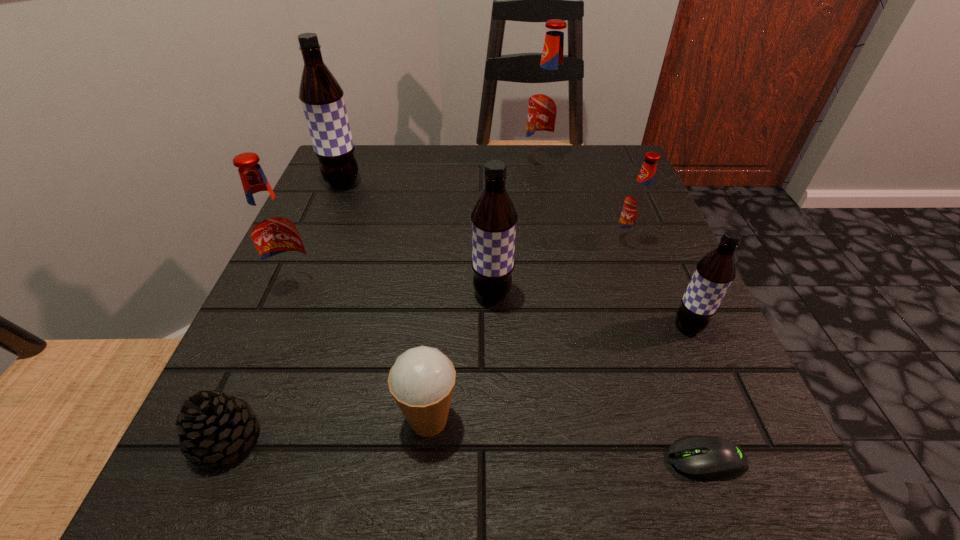
I want to click on vacant region between the second farthest root beer and the leftmost red root beer, so click(x=319, y=234).

Identify which object is located as the seventh nearest to the gray computer mouse. Please provide its 2D coordinates. Your answer should be formatted as a tuple, i.e. [(x, y)], where the tuple contains the x and y coordinates of a point satisfying the conditions above.

[(548, 98)]

Where is `the second closest object relative to the leftmost brown root beer`? Image resolution: width=960 pixels, height=540 pixels. the second closest object relative to the leftmost brown root beer is located at coordinates (494, 217).

Locate an element on the screen. the fifth closest root beer to the third shortest object is located at coordinates (322, 99).

Identify the location of the second closest root beer to the eighth tallest object. This screenshot has height=540, width=960. (494, 217).

Where is `red root beer identified as the closest to the biggest brown root beer`? The width and height of the screenshot is (960, 540). red root beer identified as the closest to the biggest brown root beer is located at coordinates (272, 228).

Where is `red root beer that is the closest to the gray computer mouse`? Image resolution: width=960 pixels, height=540 pixels. red root beer that is the closest to the gray computer mouse is located at coordinates (639, 201).

Locate an element on the screen. brown root beer that is the closest to the fifth object from left to right is located at coordinates (714, 273).

Select which brown root beer is the closest to the computer mouse. Please provide its 2D coordinates. Your answer should be formatted as a tuple, i.e. [(x, y)], where the tuple contains the x and y coordinates of a point satisfying the conditions above.

[(714, 273)]

Find the location of a particular element. The image size is (960, 540). free space that satisfies the following two spatial constraints: 1. on the front side of the nearest root beer; 2. on the left side of the third farthest root beer is located at coordinates (660, 326).